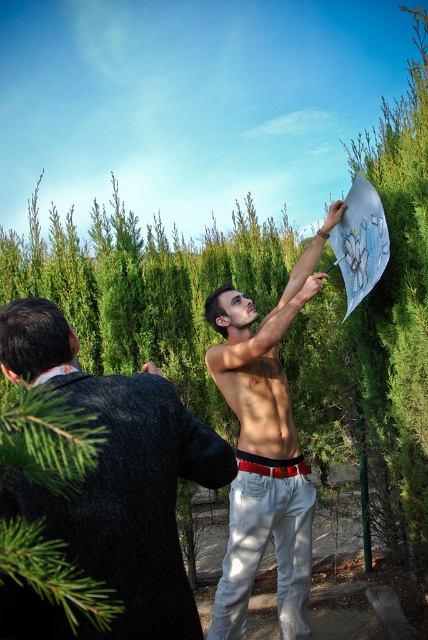
Question: Which object appears closest to the camera in this image?

Choices:
 (A) smooth gray suit at left
 (B) muscular tan skin at center

Answer: (A)

Question: Does shiny metallic shirt at center have a larger size compared to muscular tan skin at center?

Choices:
 (A) no
 (B) yes

Answer: (B)

Question: Observing the image, what is the correct spatial positioning of smooth gray suit at left in reference to muscular tan skin at center?

Choices:
 (A) right
 (B) left

Answer: (B)

Question: From the image, what is the correct spatial relationship of shiny metallic shirt at center in relation to muscular tan skin at center?

Choices:
 (A) right
 (B) left

Answer: (A)

Question: Which point is farther to the camera?

Choices:
 (A) muscular tan skin at center
 (B) smooth gray suit at left

Answer: (A)

Question: Which object appears closest to the camera in this image?

Choices:
 (A) muscular tan skin at center
 (B) smooth gray suit at left
 (C) shiny metallic shirt at center

Answer: (B)